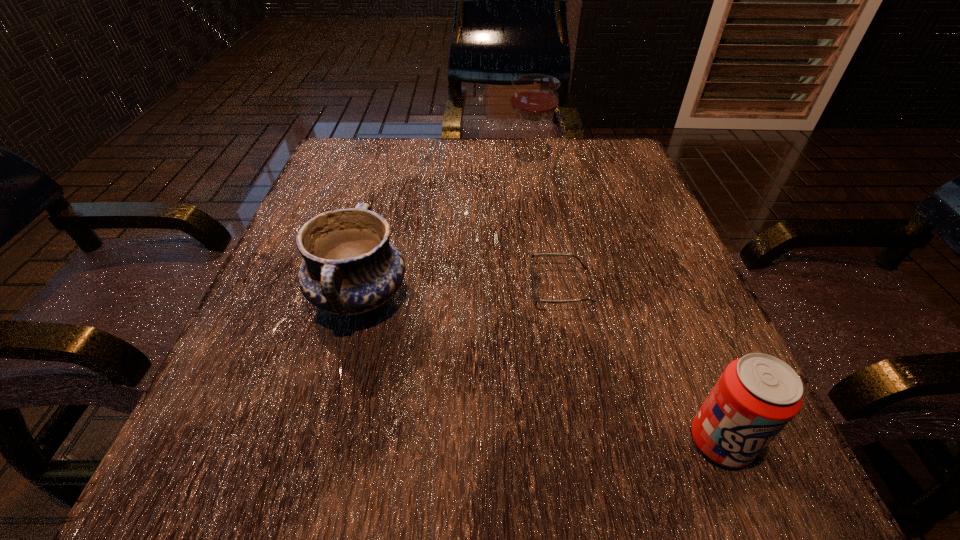
Find the location of a particular element. The height and width of the screenshot is (540, 960). the farthest object is located at coordinates (534, 97).

At what (x,y) coordinates should I click in order to perform the action: click on wineglass. Please return your answer as a coordinate pair (x, y). The height and width of the screenshot is (540, 960). Looking at the image, I should click on (534, 97).

I want to click on soda can, so click(x=756, y=396).

Locate an element on the screen. This screenshot has width=960, height=540. the rightmost object is located at coordinates (756, 396).

The width and height of the screenshot is (960, 540). In order to click on the leftmost object in this screenshot , I will do `click(350, 267)`.

You are a GUI agent. You are given a task and a screenshot of the screen. Output one action in this format:
    pyautogui.click(x=<x>, y=<y>)
    Task: Click on the sunglasses
    The width and height of the screenshot is (960, 540).
    Given the screenshot: What is the action you would take?
    (x=536, y=299)

The width and height of the screenshot is (960, 540). I want to click on free space located on the left of the wineglass, so click(x=465, y=163).

The width and height of the screenshot is (960, 540). Find the location of `vacant region located on the surface of the soda can`. vacant region located on the surface of the soda can is located at coordinates (752, 517).

You are a GUI agent. You are given a task and a screenshot of the screen. Output one action in this format:
    pyautogui.click(x=<x>, y=<y>)
    Task: Click on the vacant space located on the back of the leftmost object
    
    Given the screenshot: What is the action you would take?
    pyautogui.click(x=375, y=238)

The image size is (960, 540). I want to click on free space located on the front-facing side of the sunglasses, so click(447, 287).